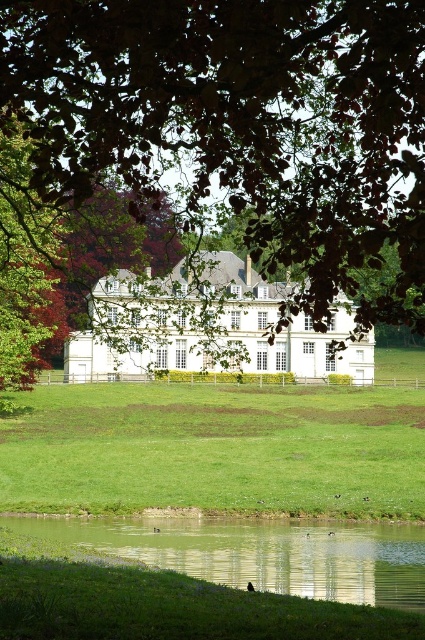
You are planning to set up a picnic blanket in the scene. The picnic blanket requires a flat area larger than the green reflective water at lower center. Can you determine if the green grassy field at lower center is suitable for placing the picnic blanket?

The green grassy field at lower center has a larger size compared to the green reflective water at lower center, so yes, the picnic blanket can be placed there as it meets the size requirement.

Based on the photo, you are standing at the edge of the calm body of water in the foreground and want to reach the green grassy field at lower center. According to the coordinates provided, in which direction should you move to get there?

The green grassy field at lower center is located at point (215, 449). Since you are at the edge of the water in the foreground, which is likely at a lower coordinate on the y or x axis depending on the coordinate system, you should move towards the direction of increasing coordinates to reach the field. However, without knowing the exact coordinate system orientation, it is safest to say that the field is positioned towards the lower center of the image, so moving towards the center of the image from the